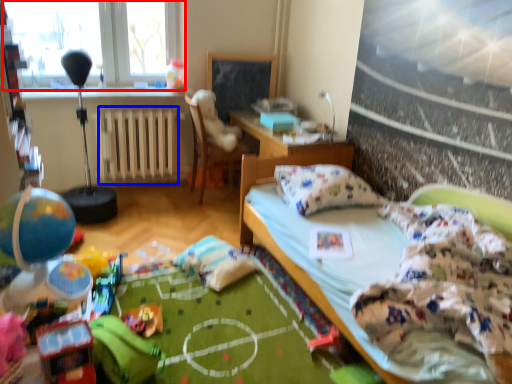
Question: Among these objects, which one is farthest to the camera, window (highlighted by a red box) or radiator (highlighted by a blue box)?

Choices:
 (A) window
 (B) radiator

Answer: (B)